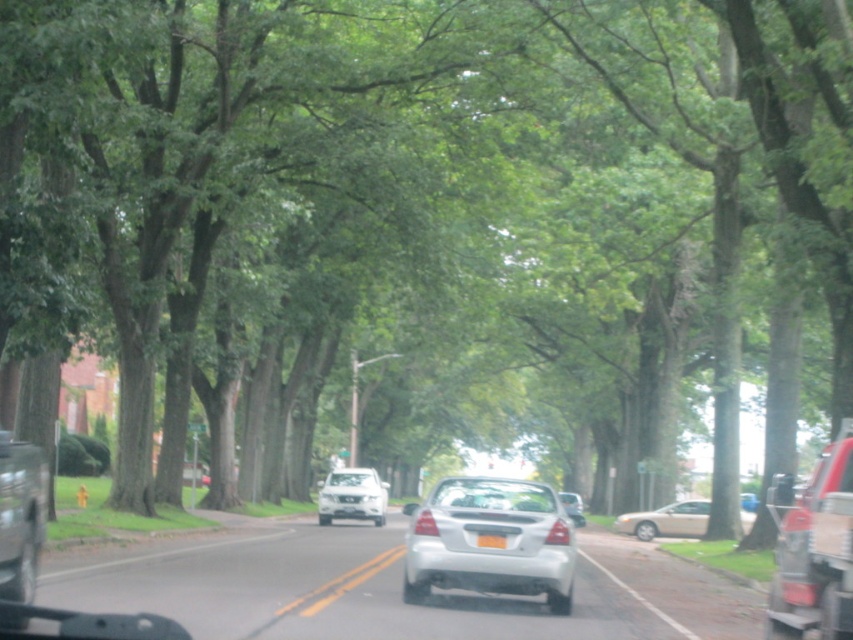
You are standing at the point marked by the coordinates point [479,545]. A friend is approaching you from the direction of the silver sedan driving towards the camera. How far will your friend have to walk to reach you?

The point [479,545] is 12.31 meters away from the viewer, so your friend will have to walk 12.31 meters to reach you.

You are a delivery driver who needs to check the license plate of the metallic silver sedan at center. Since you are standing at the curb, can you see the entire white plastic license plate at center without moving your head?

The white plastic license plate at center has a lesser width compared to metallic silver sedan at center, so yes, you can see the entire white plastic license plate at center without moving your head because it is smaller in width than the metallic silver sedan at center.